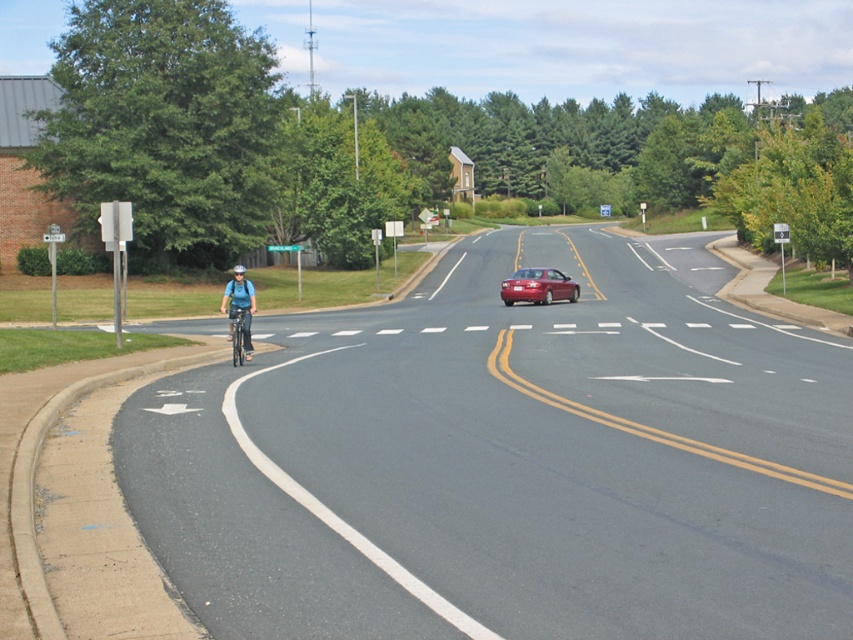
Question: Which point is closer to the camera taking this photo?

Choices:
 (A) (229, 291)
 (B) (238, 268)
 (C) (703, 339)

Answer: (A)

Question: Which object is farther from the camera taking this photo?

Choices:
 (A) matte blue helmet at left
 (B) black asphalt bike lane at left
 (C) matte blue helmet at center

Answer: (C)

Question: Does black asphalt bike lane at left have a smaller size compared to matte blue helmet at left?

Choices:
 (A) no
 (B) yes

Answer: (A)

Question: Is shiny red sedan at center below matte blue helmet at center?

Choices:
 (A) yes
 (B) no

Answer: (A)

Question: Is black asphalt bike lane at left below silver metallic bicycle at left?

Choices:
 (A) yes
 (B) no

Answer: (B)

Question: Which of the following is the closest to the observer?

Choices:
 (A) black asphalt bike lane at left
 (B) matte blue helmet at left
 (C) shiny red sedan at center
 (D) matte blue helmet at center

Answer: (A)